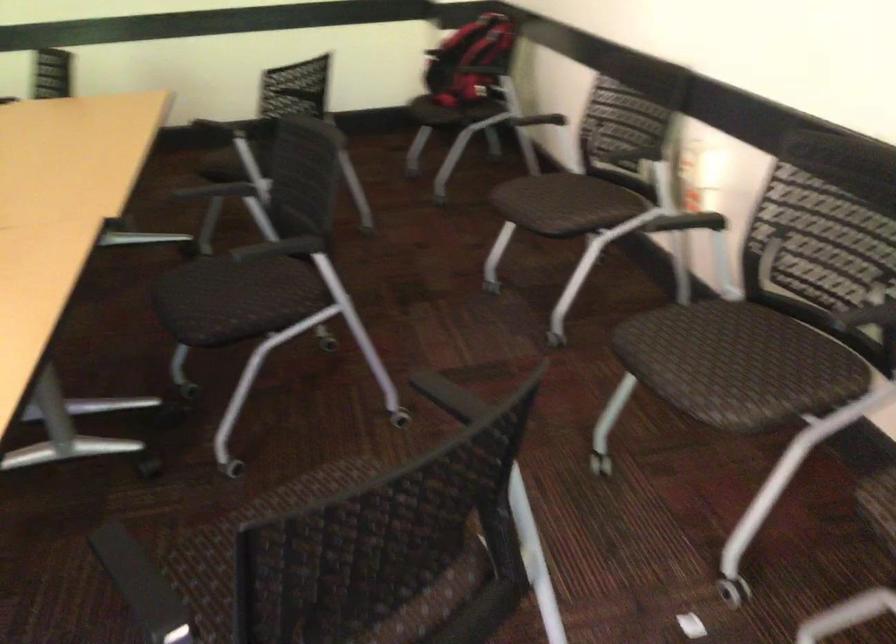
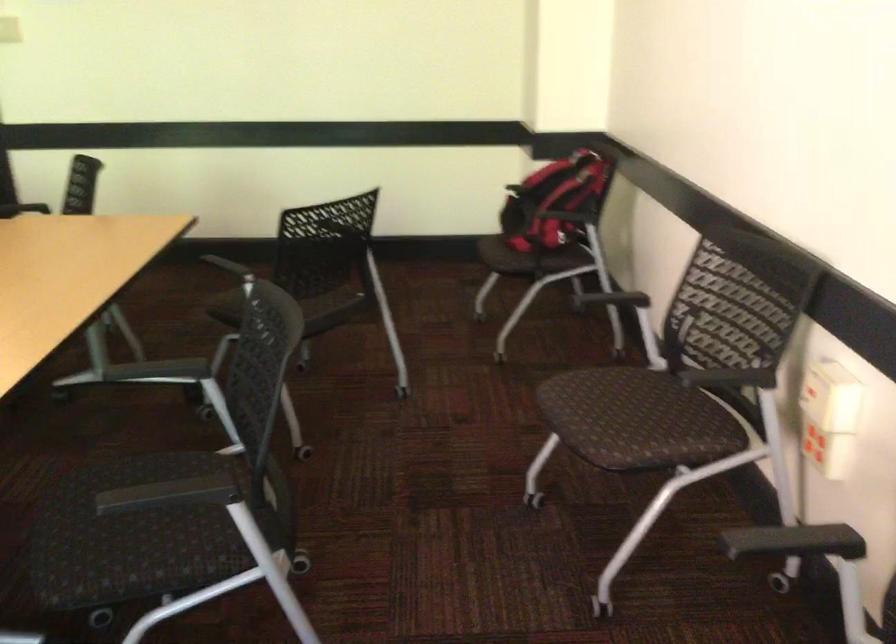
Question: In a continuous first-person perspective shot, in which direction is the camera moving?

Choices:
 (A) Left
 (B) Right
 (C) Forward
 (D) Backward

Answer: (C)